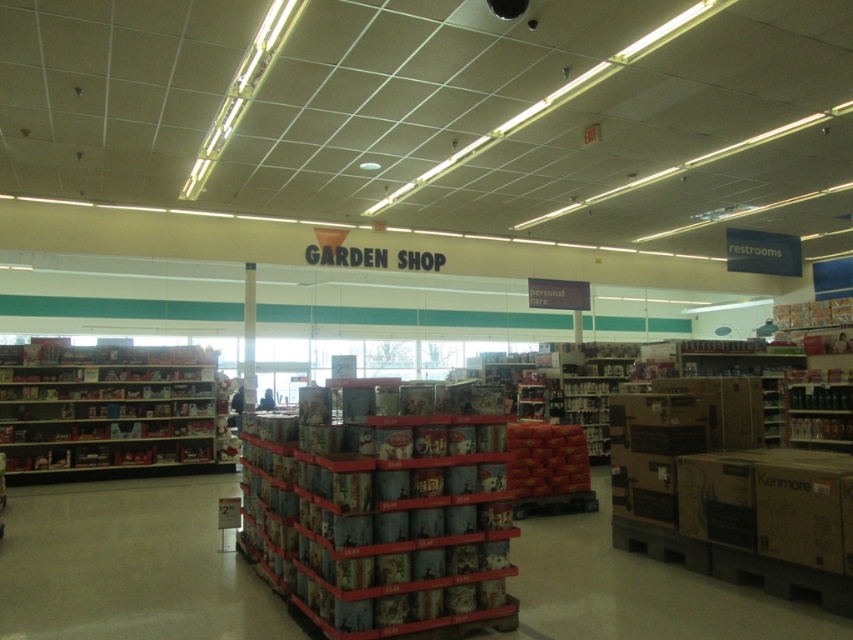
Can you confirm if metallic silver cans at center is positioned below metallic silver shelves at left?

Actually, metallic silver cans at center is above metallic silver shelves at left.

Identify the location of metallic silver cans at center. The width and height of the screenshot is (853, 640). (383, 508).

In order to click on metallic silver cans at center in this screenshot , I will do click(383, 508).